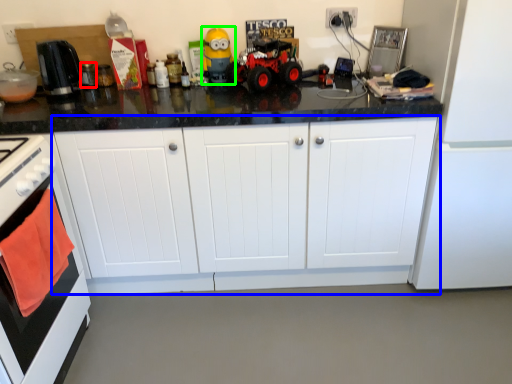
Question: Which is nearer to the appliance (highlighted by a red box)? cabinetry (highlighted by a blue box) or toy (highlighted by a green box).

Choices:
 (A) cabinetry
 (B) toy

Answer: (B)